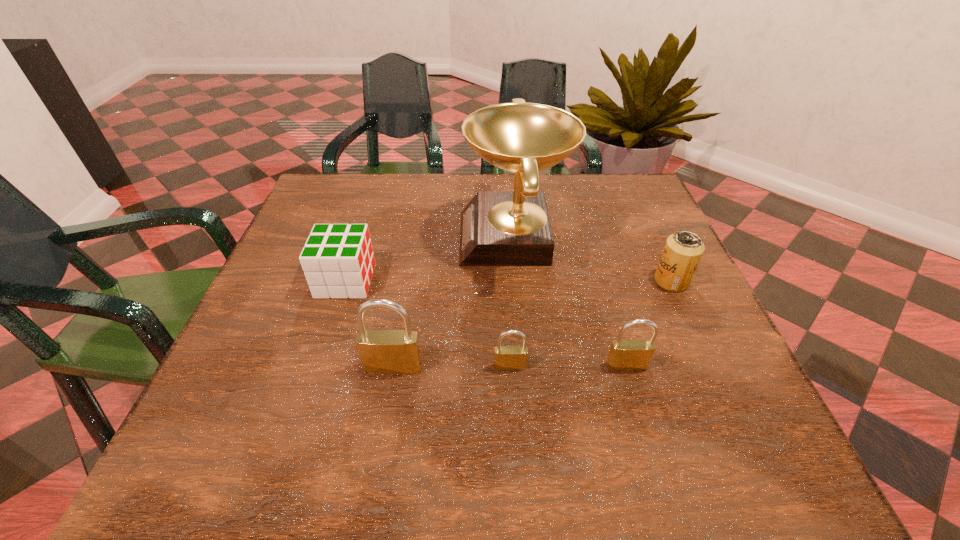
The image size is (960, 540). I want to click on free point that satisfies the following two spatial constraints: 1. on the red face of the beer can; 2. on the left side of the cube, so click(x=346, y=281).

Where is `vacant region that satisfies the following two spatial constraints: 1. on the red face of the leftmost object; 2. on the back side of the beer can`? Image resolution: width=960 pixels, height=540 pixels. vacant region that satisfies the following two spatial constraints: 1. on the red face of the leftmost object; 2. on the back side of the beer can is located at coordinates (346, 281).

Find the location of a particular element. free location that satisfies the following two spatial constraints: 1. on the back side of the rightmost object; 2. on the front-facing side of the tallest object is located at coordinates (652, 238).

Locate an element on the screen. The width and height of the screenshot is (960, 540). free point that satisfies the following two spatial constraints: 1. on the front-facing side of the tallest object; 2. on the front-facing side of the fifth object from right to left is located at coordinates (525, 367).